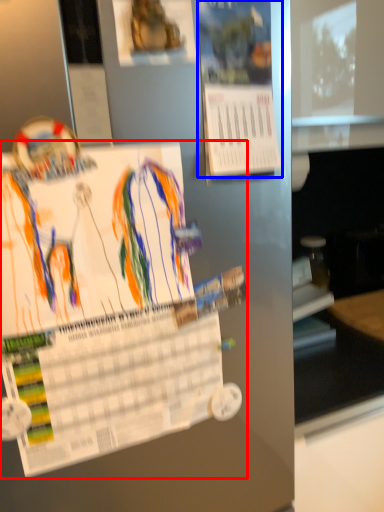
Question: Which object is further to the camera taking this photo, poster (highlighted by a red box) or poster (highlighted by a blue box)?

Choices:
 (A) poster
 (B) poster

Answer: (B)